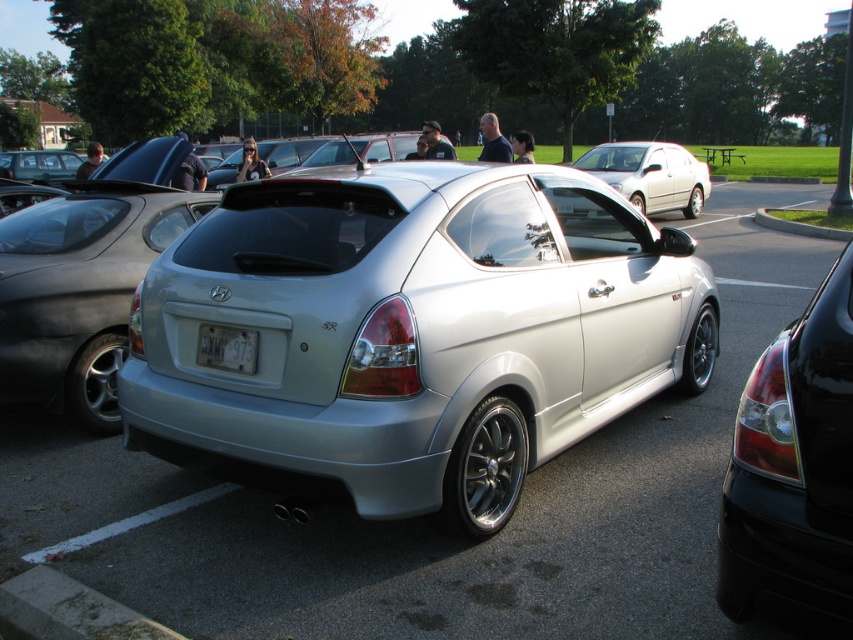
Question: Is matte black sedan at left further to camera compared to satin silver hatchback at center?

Choices:
 (A) no
 (B) yes

Answer: (A)

Question: Is matte black sedan at left below satin silver hatchback at center?

Choices:
 (A) yes
 (B) no

Answer: (A)

Question: Among these objects, which one is nearest to the camera?

Choices:
 (A) gray concrete curb at lower left
 (B) satin silver hatchback at center

Answer: (A)

Question: Considering the real-world distances, which object is farthest from the matte black sedan at left?

Choices:
 (A) glossy black sedan at right
 (B) white plastic license plate at center
 (C) gray concrete curb at lower left
 (D) satin silver hatchback at center

Answer: (D)

Question: Is matte black sedan at left positioned behind gray concrete curb at lower left?

Choices:
 (A) no
 (B) yes

Answer: (B)

Question: Among these points, which one is farthest from the camera?

Choices:
 (A) (242, 330)
 (B) (682, 588)
 (C) (846, 442)

Answer: (A)